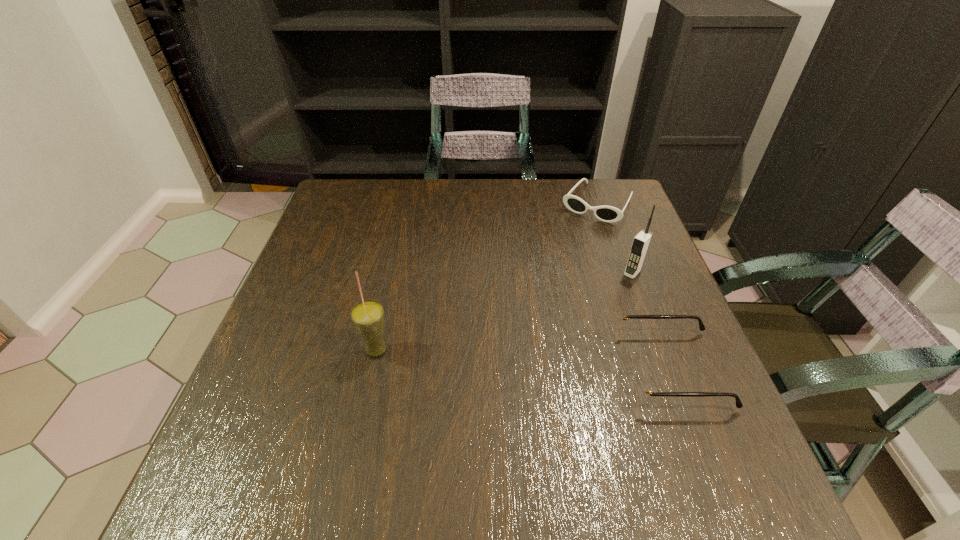
Where is `free space located 0.280m on the front-facing side of the cellular telephone`? free space located 0.280m on the front-facing side of the cellular telephone is located at coordinates (564, 347).

The image size is (960, 540). Find the location of `vacant space situated 0.240m with the lenses of the sunglasses facing outward`. vacant space situated 0.240m with the lenses of the sunglasses facing outward is located at coordinates (550, 273).

Locate an element on the screen. This screenshot has width=960, height=540. free location located with the lenses of the sunglasses facing outward is located at coordinates (575, 236).

Where is `free location located with the lenses of the sunglasses facing outward`? free location located with the lenses of the sunglasses facing outward is located at coordinates (571, 242).

The image size is (960, 540). In order to click on object that is at the far edge in this screenshot , I will do coord(609,214).

Locate an element on the screen. object located in the near edge section of the desktop is located at coordinates (640, 385).

Identify the location of spectacles at the right edge. This screenshot has height=540, width=960. coord(640,385).

Identify the location of cellular telephone that is at the right edge. The width and height of the screenshot is (960, 540). (641, 242).

Where is `sunglasses located at the right edge`? This screenshot has width=960, height=540. sunglasses located at the right edge is located at coordinates (609, 214).

Image resolution: width=960 pixels, height=540 pixels. In order to click on object that is at the far right corner in this screenshot , I will do `click(609, 214)`.